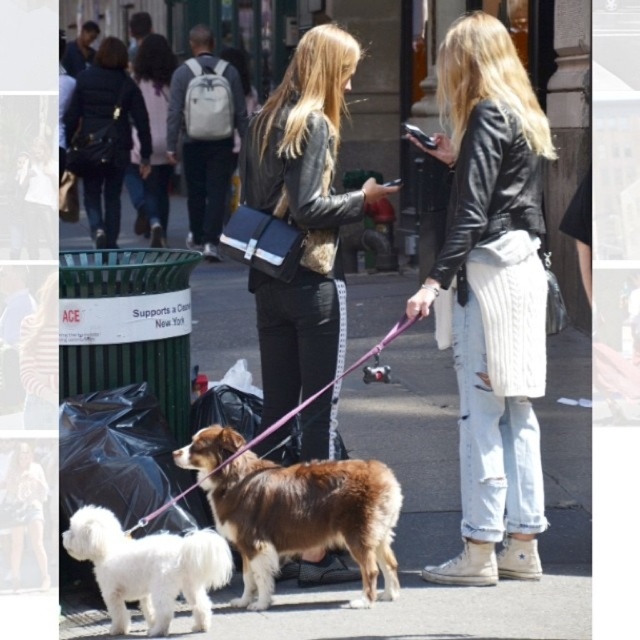
You are a dog trainer observing the scene. You need to determine if the white fluffy dog at lower left can safely approach the purple fabric leash at center without crossing a safety zone of 36 inches. Can it do so?

The distance between the white fluffy dog at lower left and the purple fabric leash at center is 34.75 inches, which is less than the 36 inches safety zone. Therefore, the white fluffy dog at lower left cannot safely approach the purple fabric leash at center without entering the restricted area.

You are a delivery person who needs to place a package on the ground. The package is 1 meter long and needs to be placed on the smooth asphalt pavement at center. However, there is a matte gray backpack at upper left nearby. Where should you place the package so it doesn

The smooth asphalt pavement at center is to the right of the matte gray backpack at upper left. You should place the package on the smooth asphalt pavement at center to the right of the matte gray backpack at upper left to ensure it fits the 1 meter length without obstruction.

You are standing at the camera position and want to walk to the point marked at coordinates [568,364]. How far will you have to walk in feet?

The point marked at coordinates [568,364] is 44.09 feet away from the camera, so you will have to walk 44.09 feet.